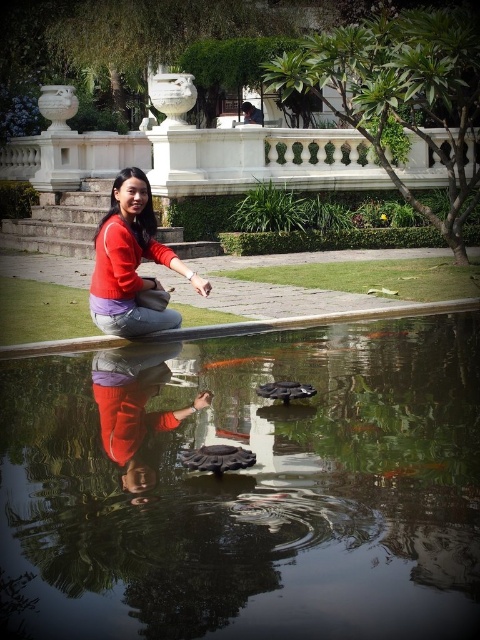
Describe the element at coordinates (132, 260) in the screenshot. I see `matte red sweater at center` at that location.

Find the location of `matte red sweater at center`. matte red sweater at center is located at coordinates (132, 260).

Locate an element on the screen. This screenshot has width=480, height=640. matte red sweater at center is located at coordinates (132, 260).

Is transparent glass fish pond at center taller than matte red pants at center?

No.

Between transparent glass fish pond at center and matte red pants at center, which one appears on the left side from the viewer's perspective?

From the viewer's perspective, matte red pants at center appears more on the left side.

Where is `transparent glass fish pond at center`? The height and width of the screenshot is (640, 480). transparent glass fish pond at center is located at coordinates [245, 488].

Is transparent glass fish pond at center smaller than matte red sweater at center?

Yes.

Between point (419, 595) and point (148, 332), which one is positioned in front?

Point (419, 595) is more forward.

Is point (292, 504) behind point (140, 195)?

No, it is not.

Where is `transparent glass fish pond at center`? transparent glass fish pond at center is located at coordinates (245, 488).